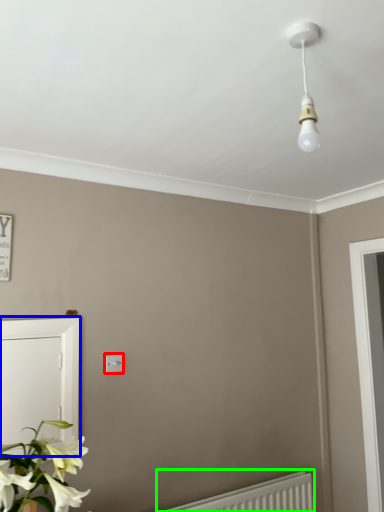
Question: Which is farther away from light switch (highlighted by a red box)? screen door (highlighted by a blue box) or radiator (highlighted by a green box)?

Choices:
 (A) screen door
 (B) radiator

Answer: (B)